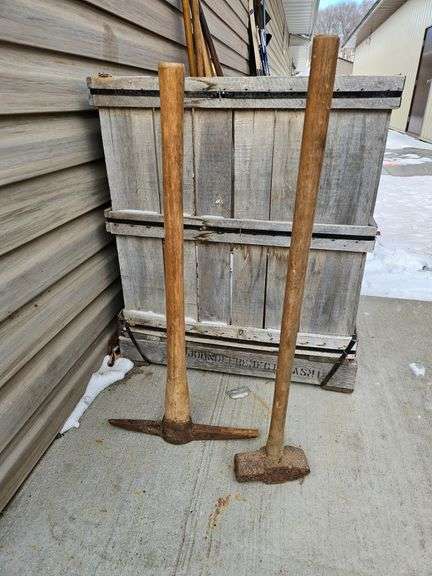
Find the location of a particular element. The image size is (432, 576). floor is located at coordinates point(118,519).